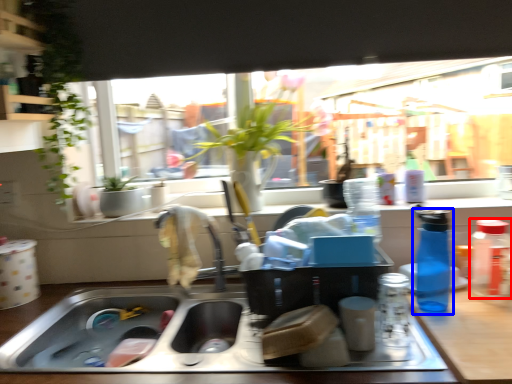
Question: Among these objects, which one is nearest to the camera, bottle (highlighted by a red box) or bottle (highlighted by a blue box)?

Choices:
 (A) bottle
 (B) bottle

Answer: (B)